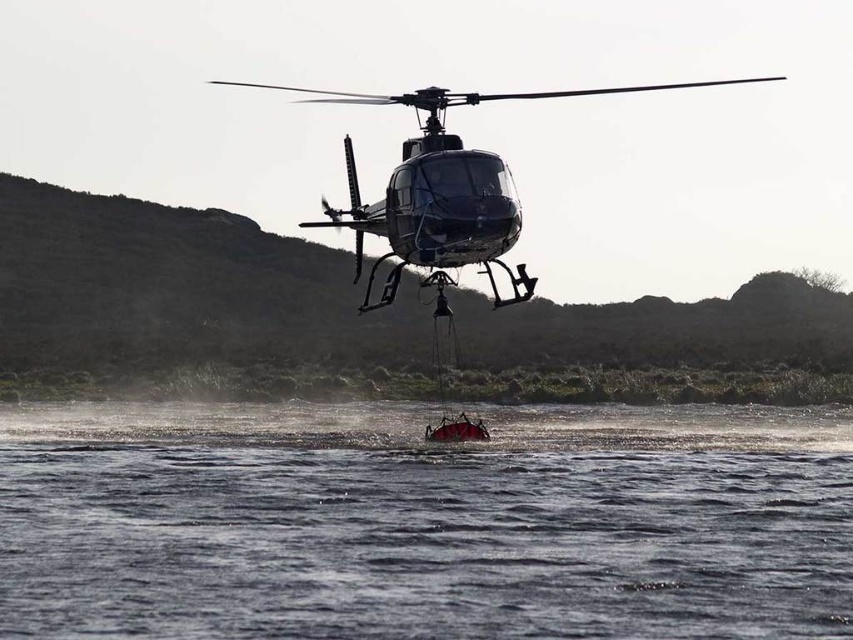
Question: Does metallic dark gray helicopter at center have a smaller size compared to red matte boat at center?

Choices:
 (A) no
 (B) yes

Answer: (A)

Question: Based on their relative distances, which object is farther from the red rubber boat at lower center?

Choices:
 (A) metallic dark gray helicopter at center
 (B) red matte boat at center

Answer: (A)

Question: Which point is farther to the camera?

Choices:
 (A) metallic dark gray helicopter at center
 (B) red matte boat at center
 (C) red rubber boat at lower center

Answer: (B)

Question: Does metallic dark gray helicopter at center come in front of red matte boat at center?

Choices:
 (A) no
 (B) yes

Answer: (B)

Question: Is red rubber boat at lower center closer to camera compared to metallic dark gray helicopter at center?

Choices:
 (A) no
 (B) yes

Answer: (B)

Question: Which object is farther from the camera taking this photo?

Choices:
 (A) metallic dark gray helicopter at center
 (B) red rubber boat at lower center
 (C) red matte boat at center

Answer: (C)